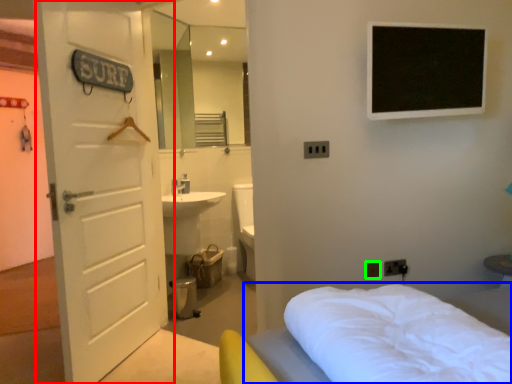
Question: Considering the real-world distances, which object is farthest from door (highlighted by a red box)? bed (highlighted by a blue box) or electric outlet (highlighted by a green box)?

Choices:
 (A) bed
 (B) electric outlet

Answer: (B)